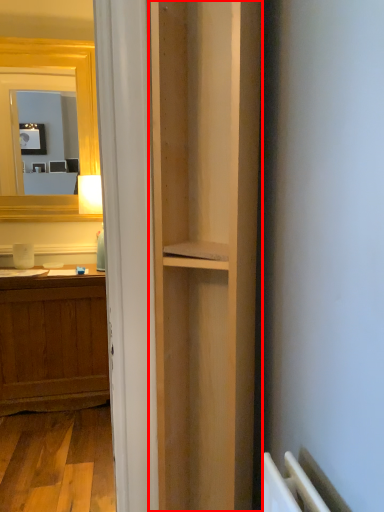
Question: Considering the relative positions of bookshelf (annotated by the red box) and corridor in the image provided, where is bookshelf (annotated by the red box) located with respect to the staircase?

Choices:
 (A) left
 (B) right

Answer: (B)